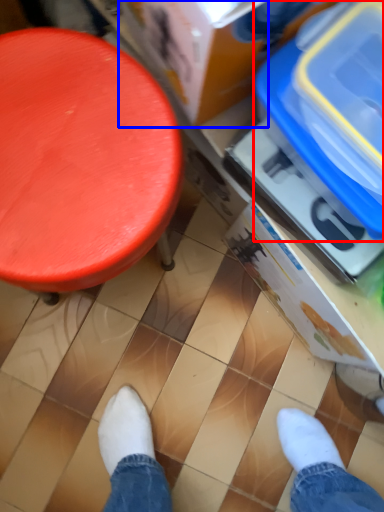
Question: Which object is closer to the camera taking this photo, storage box (highlighted by a red box) or storage box (highlighted by a blue box)?

Choices:
 (A) storage box
 (B) storage box

Answer: (B)